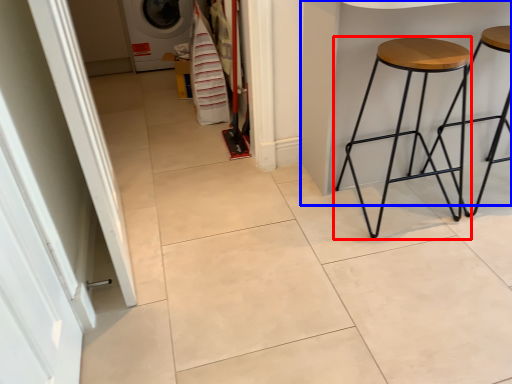
Question: Which object appears farthest to the camera in this image, stool (highlighted by a red box) or table (highlighted by a blue box)?

Choices:
 (A) stool
 (B) table

Answer: (A)